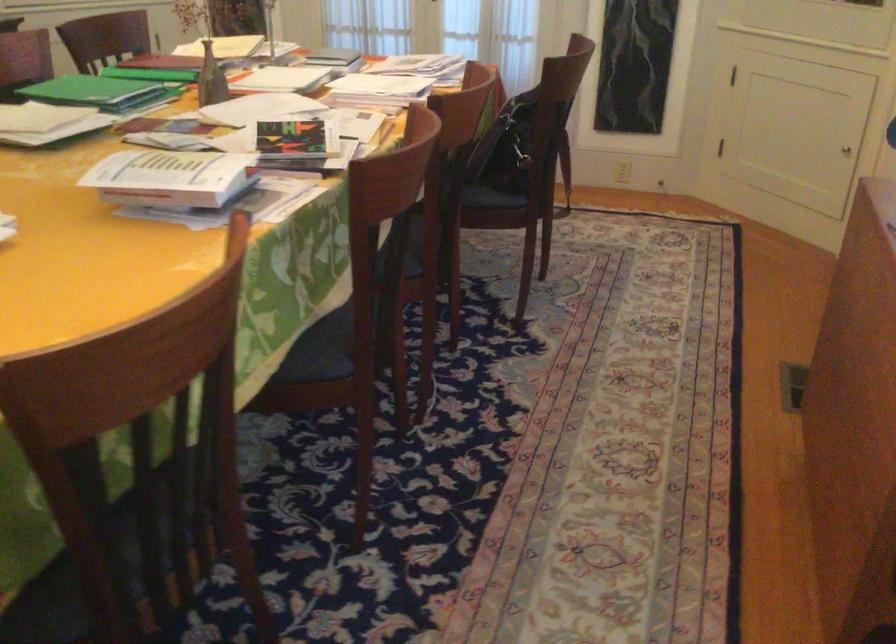
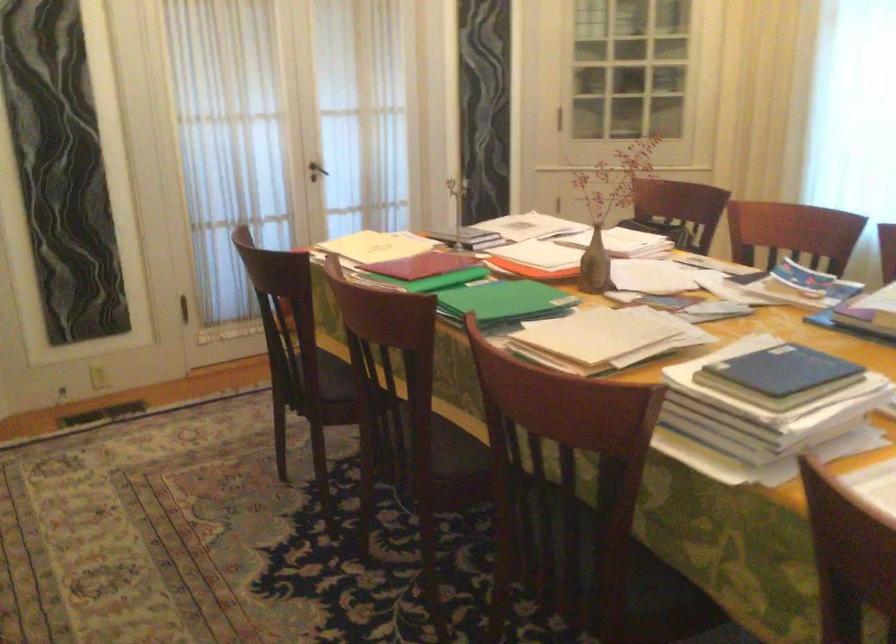
The point at (207, 77) is marked in the first image. Where is the corresponding point in the second image?

(595, 265)